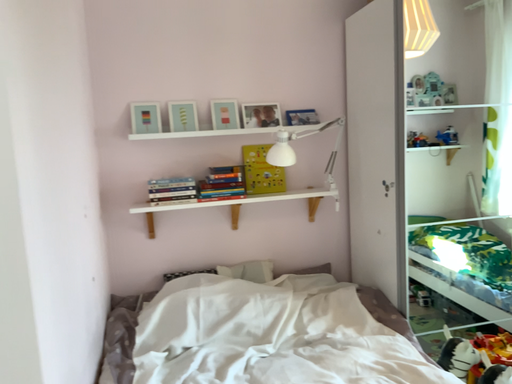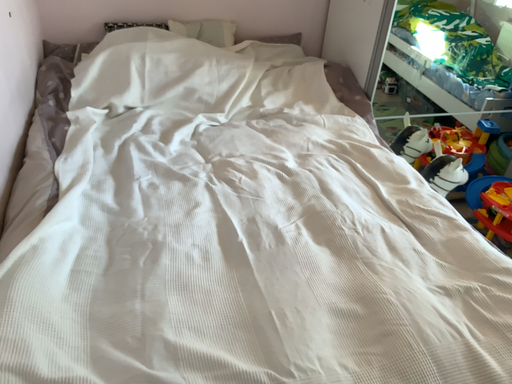
Question: Which way did the camera rotate in the video?

Choices:
 (A) rotated upward
 (B) rotated downward

Answer: (B)